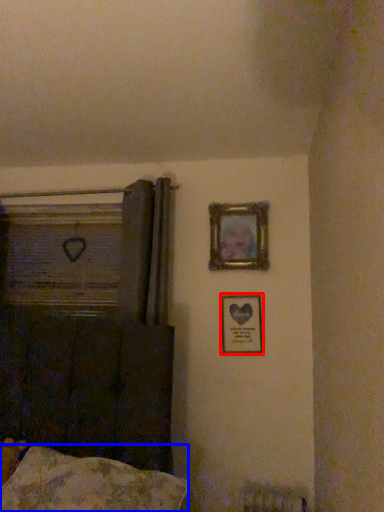
Question: Which of the following is the farthest to the observer, picture frame (highlighted by a red box) or pillow (highlighted by a blue box)?

Choices:
 (A) picture frame
 (B) pillow

Answer: (A)